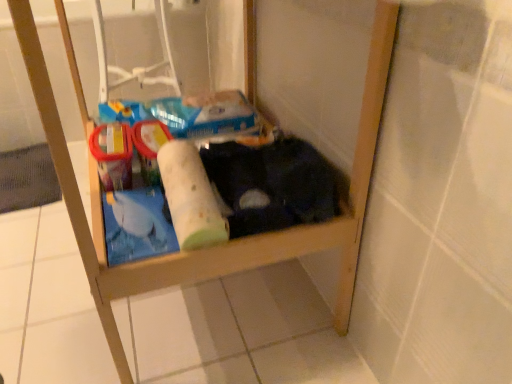
The width and height of the screenshot is (512, 384). I want to click on white matte toilet paper at center, so click(x=190, y=197).

The height and width of the screenshot is (384, 512). What do you see at coordinates (190, 197) in the screenshot? I see `white matte toilet paper at center` at bounding box center [190, 197].

The height and width of the screenshot is (384, 512). Find the location of `white matte toilet paper at center`. white matte toilet paper at center is located at coordinates (190, 197).